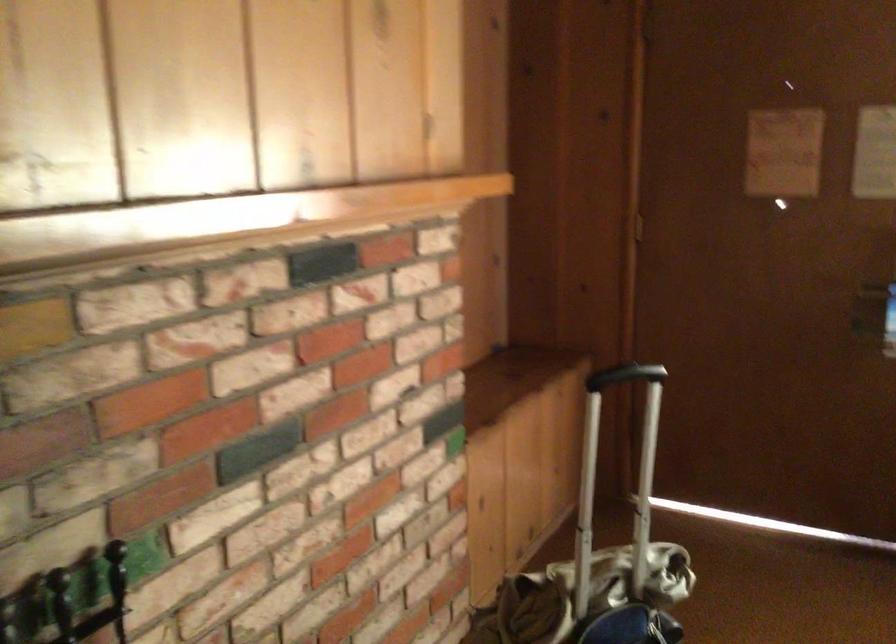
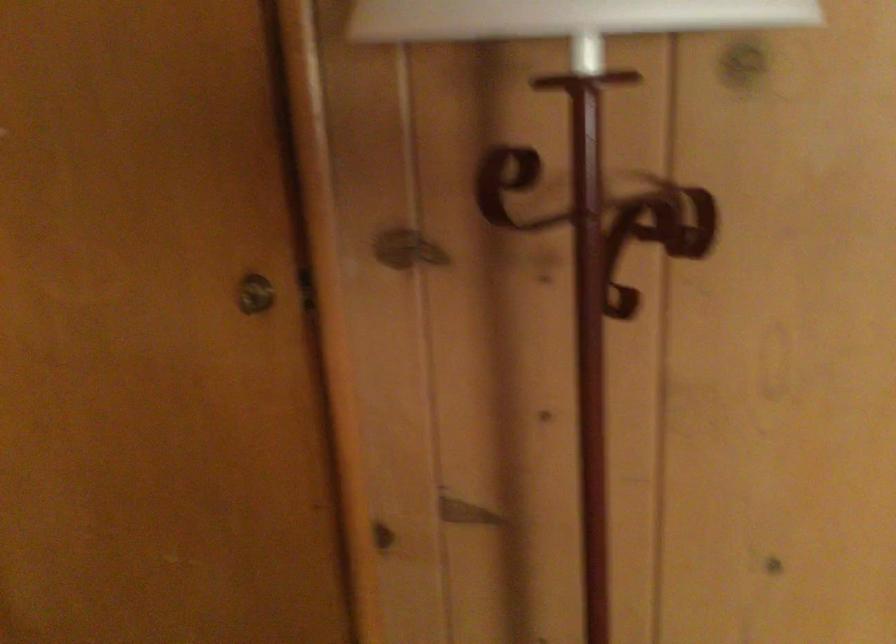
The first image is from the beginning of the video and the second image is from the end. How did the camera likely rotate when shooting the video?

The camera's rotation is toward left-down.